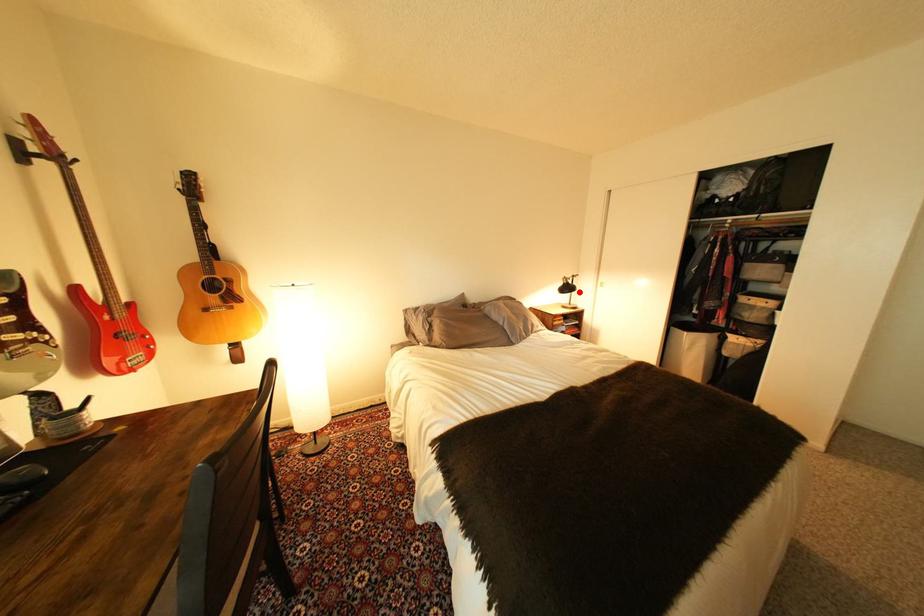
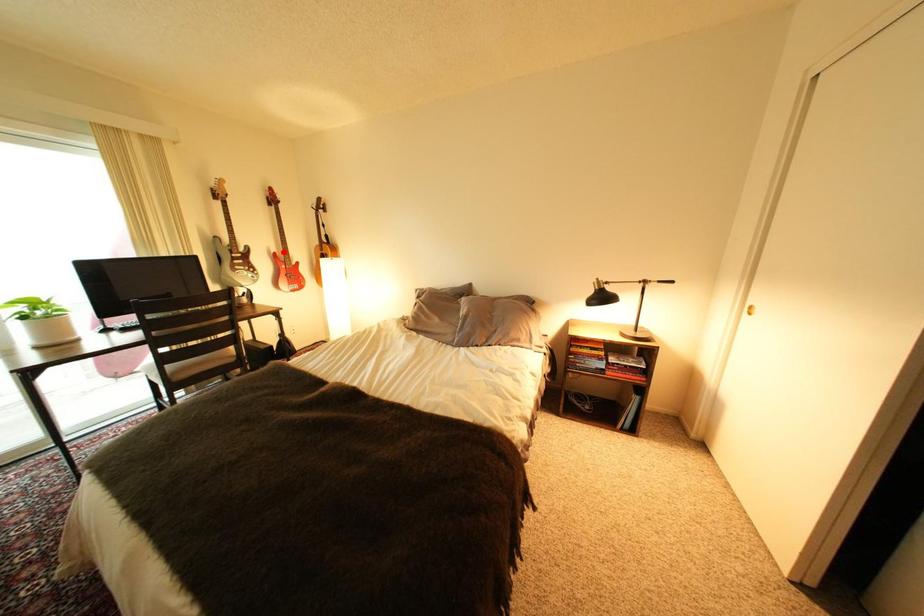
I am providing you with two images of the same scene from different viewpoints. A red point is marked on the first image and another point is marked on the second image. Is the red point in image1 aligned with the point shown in image2?

No